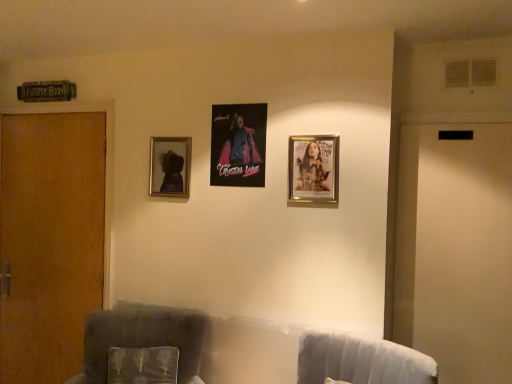
Question: From their relative heights in the image, would you say velvet gray swivel chair at lower right is taller or shorter than velvety green pillow at lower left?

Choices:
 (A) short
 (B) tall

Answer: (A)

Question: Is point (411, 362) closer or farther from the camera than point (161, 382)?

Choices:
 (A) closer
 (B) farther

Answer: (A)

Question: Which object is the closest to the gold metallic picture frame at upper right, which is the third picture frame from back to front?

Choices:
 (A) velvet dark gray armchair at left
 (B) matte black portrait at upper left, positioned as the 3th picture frame in right-to-left order
 (C) brown wood door at left
 (D) velvet gray swivel chair at lower right
 (E) metallic poster at center, acting as the 2th picture frame starting from the right

Answer: (E)

Question: Estimate the real-world distances between objects in this image. Which object is farther from the velvet dark gray armchair at left?

Choices:
 (A) velvet gray swivel chair at lower right
 (B) matte black portrait at upper left, positioned as the 3th picture frame in right-to-left order
 (C) brown wood door at left
 (D) gold metallic picture frame at upper right, which is counted as the 3th picture frame, starting from the left
 (E) metallic poster at center, the 2th picture frame positioned from the front

Answer: (D)